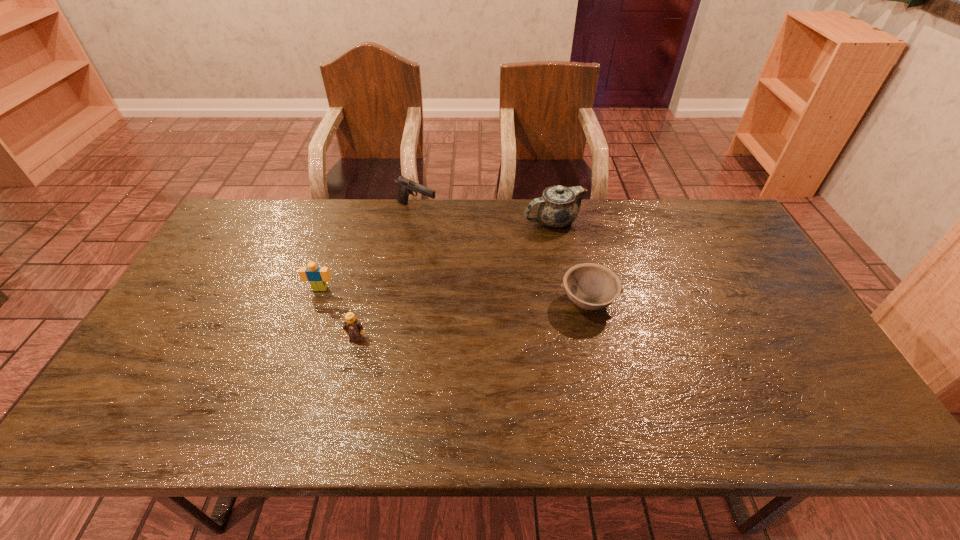
This screenshot has height=540, width=960. Identify the location of free space between the farther Lego and the bowl. (454, 295).

Find the location of a particular element. This screenshot has height=540, width=960. object that is the third nearest to the farther Lego is located at coordinates (558, 207).

Identify which object is the nearest to the bowl. Please provide its 2D coordinates. Your answer should be formatted as a tuple, i.e. [(x, y)], where the tuple contains the x and y coordinates of a point satisfying the conditions above.

[(558, 207)]

Where is `free point that satisfies the following two spatial constraints: 1. from the spout of the tallest object; 2. on the back side of the shortest object`? The height and width of the screenshot is (540, 960). free point that satisfies the following two spatial constraints: 1. from the spout of the tallest object; 2. on the back side of the shortest object is located at coordinates (569, 301).

Find the location of `vacant space that satisfies the following two spatial constraints: 1. from the spout of the chinaware; 2. on the right side of the shortest object`. vacant space that satisfies the following two spatial constraints: 1. from the spout of the chinaware; 2. on the right side of the shortest object is located at coordinates (x=569, y=301).

You are a GUI agent. You are given a task and a screenshot of the screen. Output one action in this format:
    pyautogui.click(x=<x>, y=<y>)
    Task: Click on the free space that satisfies the following two spatial constraints: 1. on the back side of the bowl; 2. at the muzzle of the gun
    
    Given the screenshot: What is the action you would take?
    566,209

In order to click on vacant space that satisfies the following two spatial constraints: 1. from the spout of the chinaware; 2. in front of the right Lego in this screenshot , I will do `click(576, 338)`.

I want to click on vacant position in the image that satisfies the following two spatial constraints: 1. at the muzzle of the gun; 2. on the left side of the bowl, so click(401, 301).

Locate an element on the screen. The height and width of the screenshot is (540, 960). vacant position in the image that satisfies the following two spatial constraints: 1. on the back side of the bowl; 2. at the muzzle of the gun is located at coordinates (566, 209).

The width and height of the screenshot is (960, 540). I want to click on vacant space that satisfies the following two spatial constraints: 1. on the face of the shortest object; 2. on the left side of the leftmost object, so click(316, 301).